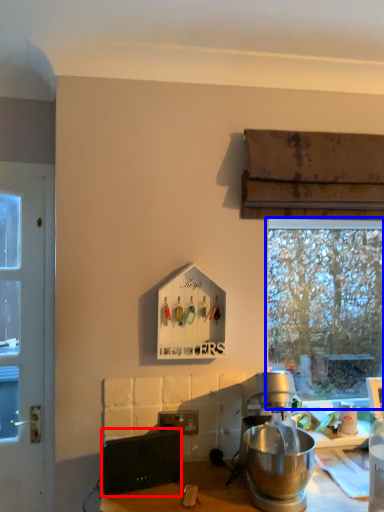
Question: Which of the following is the closest to the observer, appliance (highlighted by a red box) or window (highlighted by a blue box)?

Choices:
 (A) appliance
 (B) window

Answer: (A)